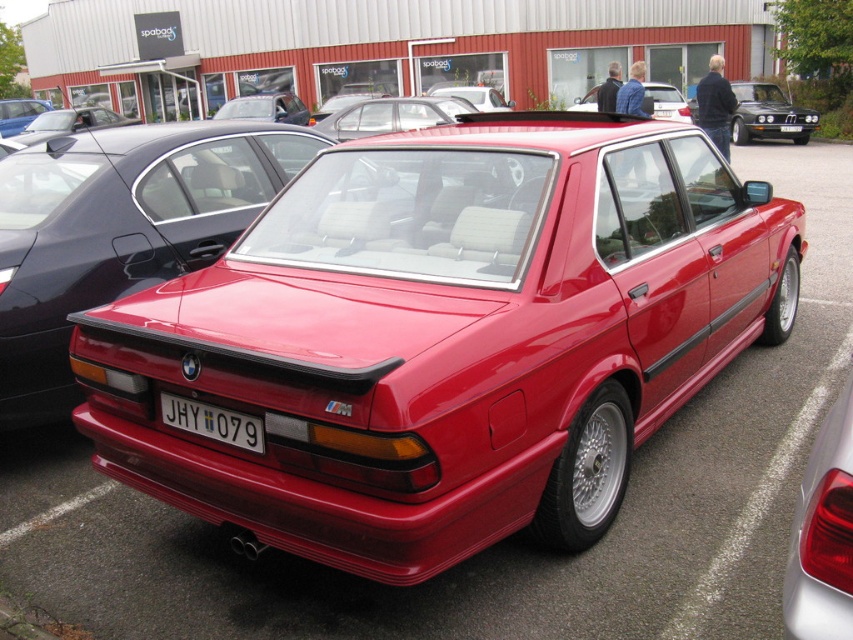
Question: Can you confirm if glossy black sedan at upper right is bigger than glossy metallic car at upper left?

Choices:
 (A) no
 (B) yes

Answer: (A)

Question: Among these points, which one is farthest from the camera?

Choices:
 (A) (0, 118)
 (B) (666, 108)
 (C) (751, 115)
 (D) (228, 432)

Answer: (A)

Question: Which of the following is the closest to the observer?

Choices:
 (A) white plastic license plate at center
 (B) glossy black sedan at upper right
 (C) glossy white taillight at lower right
 (D) glossy metallic car at upper left

Answer: (C)

Question: Is the position of white plastic license plate at center less distant than that of glossy metallic car at upper left?

Choices:
 (A) no
 (B) yes

Answer: (B)

Question: Is glossy black sedan at upper right wider than white plastic license plate at center?

Choices:
 (A) no
 (B) yes

Answer: (B)

Question: Estimate the real-world distances between objects in this image. Which object is farther from the white plastic license plate at center?

Choices:
 (A) glossy red sedan at center
 (B) glossy metallic car at upper left
 (C) glossy black sedan at upper right

Answer: (B)